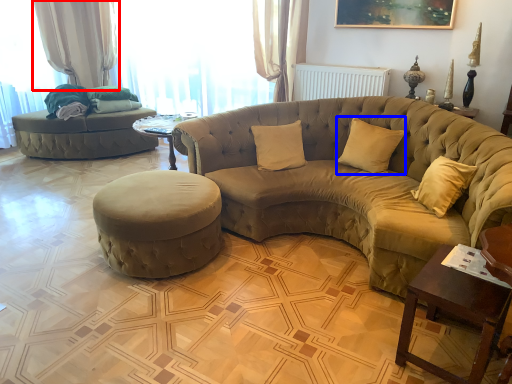
Question: Which point is further to the camera, curtain (highlighted by a red box) or pillow (highlighted by a blue box)?

Choices:
 (A) curtain
 (B) pillow

Answer: (A)